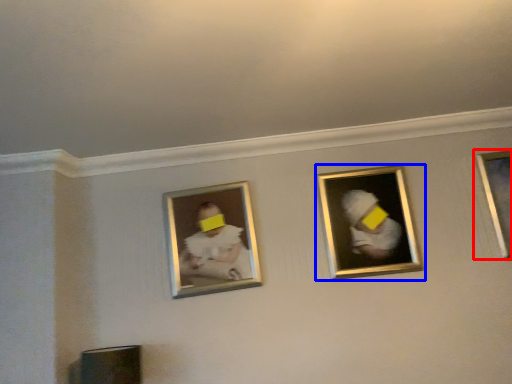
Question: Which point is further to the camera, picture frame (highlighted by a red box) or picture frame (highlighted by a blue box)?

Choices:
 (A) picture frame
 (B) picture frame

Answer: (A)